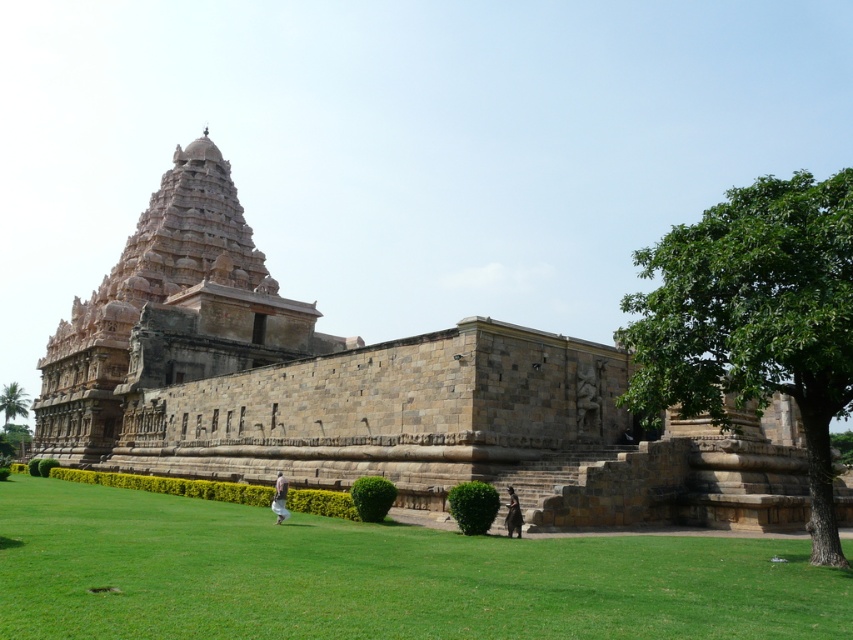
Which is below, brown stone temple at center or white cotton pants at lower center?

white cotton pants at lower center is lower down.

Is brown stone temple at center to the left of white cotton pants at lower center from the viewer's perspective?

Correct, you'll find brown stone temple at center to the left of white cotton pants at lower center.

Find the location of a particular element. brown stone temple at center is located at coordinates (372, 392).

Find the location of a particular element. brown stone temple at center is located at coordinates (372, 392).

Consider the image. Can you confirm if green grass at lower center is smaller than dark brown fabric at lower center?

Incorrect, green grass at lower center is not smaller in size than dark brown fabric at lower center.

Consider the image. Measure the distance from green grass at lower center to dark brown fabric at lower center.

They are 12.74 meters apart.

Is point (62, 561) positioned in front of point (512, 515)?

Yes.

Identify the location of green grass at lower center. The height and width of the screenshot is (640, 853). (378, 577).

Measure the distance from green grass at lower center to green leafy tree at lower left.

559.59 feet

Where is `green grass at lower center`? green grass at lower center is located at coordinates (378, 577).

What are the coordinates of `green grass at lower center` in the screenshot? It's located at (378, 577).